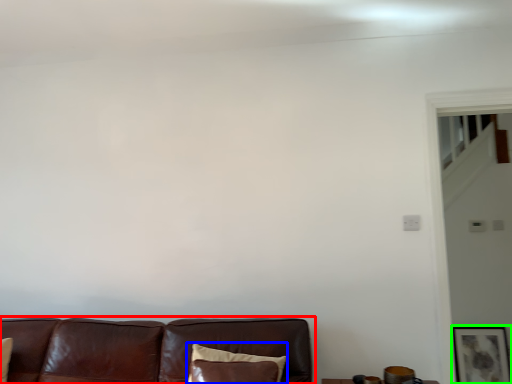
Question: Estimate the real-world distances between objects in this image. Which object is closer to studio couch (highlighted by a red box), pillow (highlighted by a blue box) or picture frame (highlighted by a green box)?

Choices:
 (A) pillow
 (B) picture frame

Answer: (A)